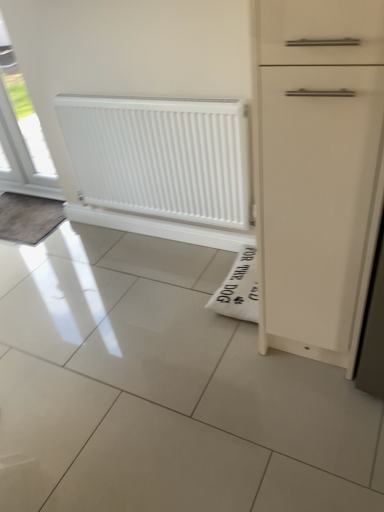
Question: Considering the relative sizes of white glossy window at upper left and dark gray textured mat at left in the image provided, is white glossy window at upper left shorter than dark gray textured mat at left?

Choices:
 (A) no
 (B) yes

Answer: (A)

Question: Does white glossy window at upper left appear on the left side of dark gray textured mat at left?

Choices:
 (A) yes
 (B) no

Answer: (B)

Question: Is white glossy window at upper left closer to the viewer compared to dark gray textured mat at left?

Choices:
 (A) no
 (B) yes

Answer: (B)

Question: Is white glossy window at upper left directly adjacent to dark gray textured mat at left?

Choices:
 (A) yes
 (B) no

Answer: (B)

Question: Does white glossy window at upper left come behind dark gray textured mat at left?

Choices:
 (A) yes
 (B) no

Answer: (B)

Question: Is white glossy window at upper left positioned beyond the bounds of dark gray textured mat at left?

Choices:
 (A) no
 (B) yes

Answer: (B)

Question: Are white smooth radiator at center and white glossy window at upper left located far from each other?

Choices:
 (A) no
 (B) yes

Answer: (B)

Question: Is white smooth radiator at center taller than white glossy window at upper left?

Choices:
 (A) no
 (B) yes

Answer: (A)

Question: From a real-world perspective, is white smooth radiator at center on white glossy window at upper left?

Choices:
 (A) no
 (B) yes

Answer: (A)

Question: Is white glossy window at upper left surrounded by white smooth radiator at center?

Choices:
 (A) no
 (B) yes

Answer: (A)

Question: Does white smooth radiator at center have a lesser width compared to white glossy window at upper left?

Choices:
 (A) no
 (B) yes

Answer: (B)

Question: Is white smooth radiator at center bigger than white glossy window at upper left?

Choices:
 (A) no
 (B) yes

Answer: (B)

Question: Is white glossy window at upper left shorter than white smooth radiator at center?

Choices:
 (A) no
 (B) yes

Answer: (A)